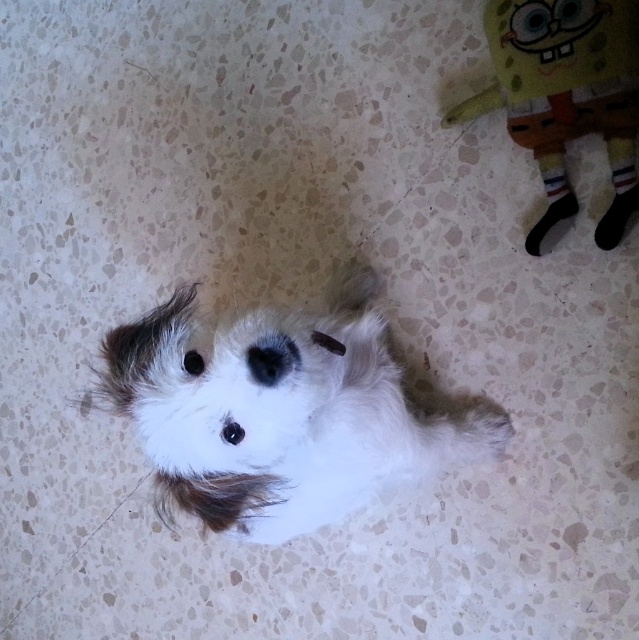
Question: Does fluffy white dog at center have a lesser width compared to yellow plush toy at upper right?

Choices:
 (A) no
 (B) yes

Answer: (A)

Question: Which object is closer to the camera taking this photo?

Choices:
 (A) fluffy white dog at center
 (B) yellow plush toy at upper right

Answer: (A)

Question: Is fluffy white dog at center closer to camera compared to yellow plush toy at upper right?

Choices:
 (A) yes
 (B) no

Answer: (A)

Question: Considering the relative positions of fluffy white dog at center and yellow plush toy at upper right in the image provided, where is fluffy white dog at center located with respect to yellow plush toy at upper right?

Choices:
 (A) below
 (B) above

Answer: (A)

Question: Among these objects, which one is farthest from the camera?

Choices:
 (A) yellow plush toy at upper right
 (B) fluffy white dog at center

Answer: (A)

Question: Which of the following is the closest to the observer?

Choices:
 (A) fluffy white dog at center
 (B) yellow plush toy at upper right

Answer: (A)